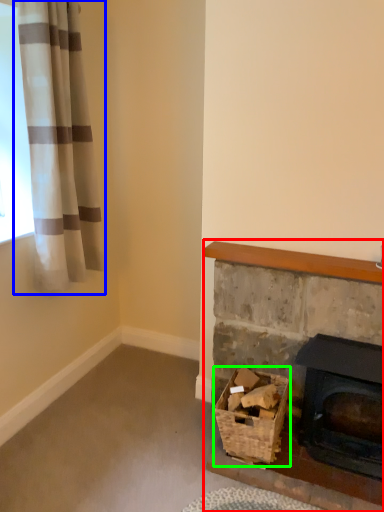
Question: Considering the real-world distances, which object is farthest from fireplace (highlighted by a red box)? curtain (highlighted by a blue box) or basket (highlighted by a green box)?

Choices:
 (A) curtain
 (B) basket

Answer: (A)